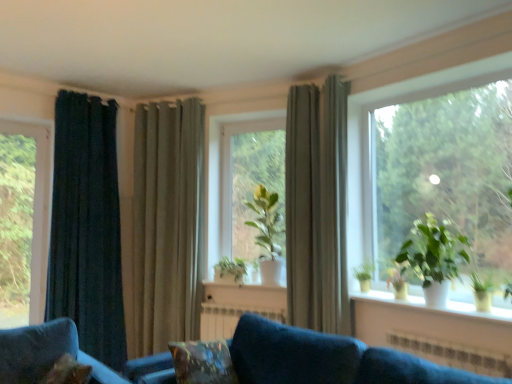
Image resolution: width=512 pixels, height=384 pixels. What are the coordinates of `empty space that is ontop of white metallic radiator at center` in the screenshot? It's located at pos(233,305).